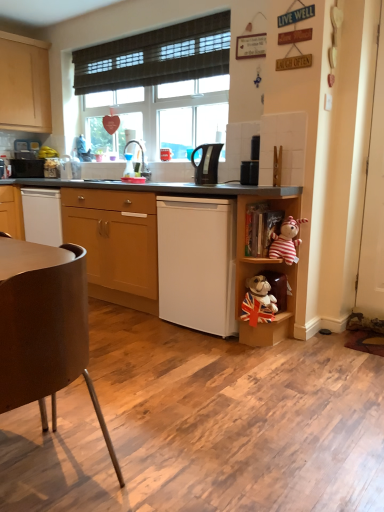
Locate an element on the screen. This screenshot has height=512, width=384. free space between brown matte chair at lower left and wooden shelf at right, the second shelf from the bottom is located at coordinates (166, 385).